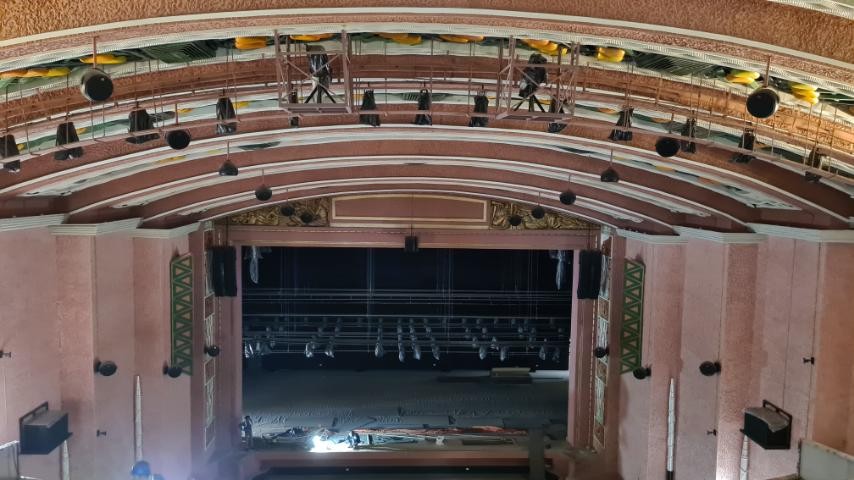
This screenshot has width=854, height=480. In order to click on black and gray mounted speakers in this screenshot , I will do `click(44, 429)`, `click(769, 420)`.